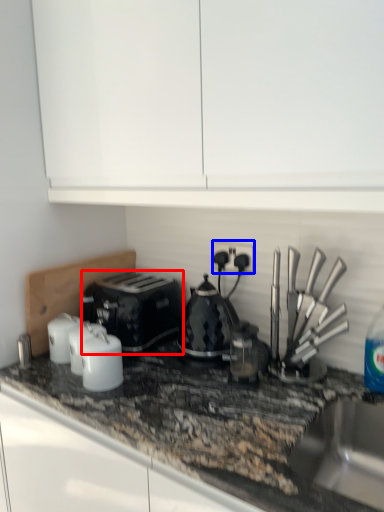
Question: Which object is further to the camera taking this photo, toaster (highlighted by a red box) or electric outlet (highlighted by a blue box)?

Choices:
 (A) toaster
 (B) electric outlet

Answer: (B)